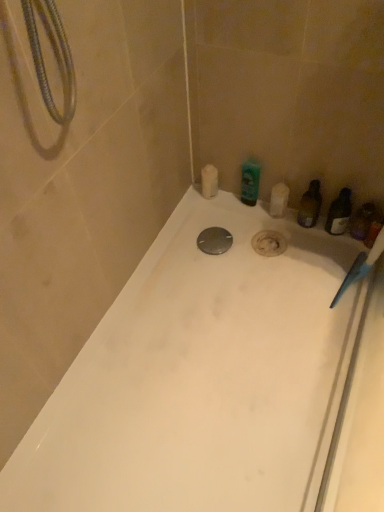
What are the coordinates of `blank area to the left of metallic silver drain at center` in the screenshot? It's located at (176, 257).